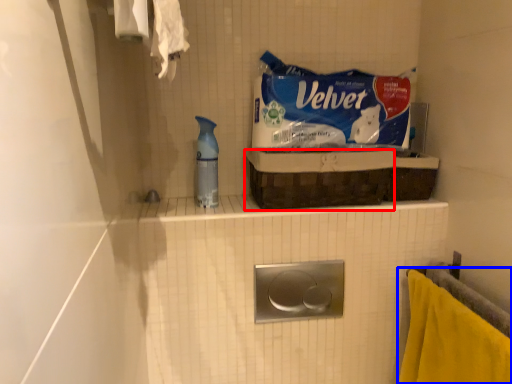
Question: Which point is further to the camera, basket (highlighted by a red box) or towel (highlighted by a blue box)?

Choices:
 (A) basket
 (B) towel

Answer: (A)